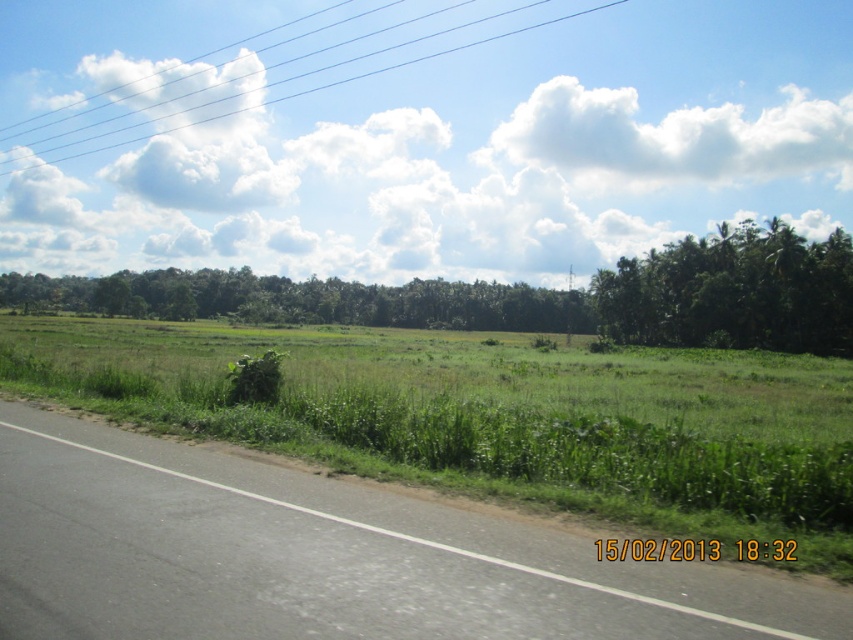
Between green leafy trees at center and white wire at upper center, which one has more height?

Standing taller between the two is white wire at upper center.

Who is higher up, green leafy trees at center or white wire at upper center?

white wire at upper center is above.

Is point (15, 301) positioned before point (604, 3)?

Yes.

In order to click on green leafy trees at center in this screenshot , I will do `click(305, 300)`.

Who is more forward, (53, 435) or (13, 298)?

Point (53, 435) is more forward.

This screenshot has height=640, width=853. In order to click on black asphalt road at lower left in this screenshot , I will do `click(323, 556)`.

Which of these two, green leafy trees at right or white wire at upper center, stands taller?

white wire at upper center

This screenshot has width=853, height=640. What do you see at coordinates (733, 292) in the screenshot?
I see `green leafy trees at right` at bounding box center [733, 292].

Is point (759, 340) less distant than point (320, 90)?

Yes, it is.

Where is `green leafy trees at right`? The height and width of the screenshot is (640, 853). green leafy trees at right is located at coordinates (733, 292).